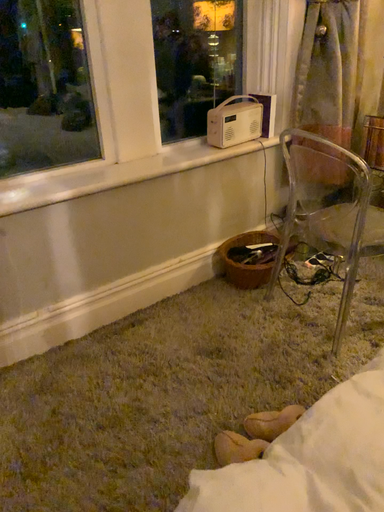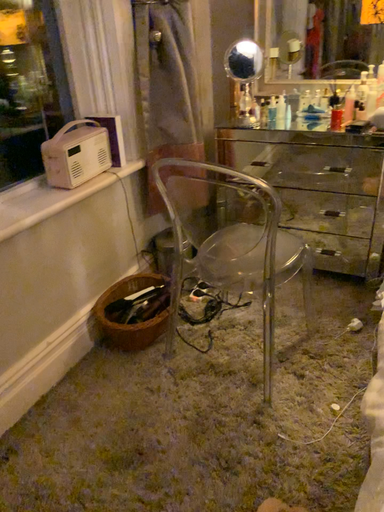
Question: How did the camera likely rotate when shooting the video?

Choices:
 (A) rotated right
 (B) rotated left

Answer: (A)